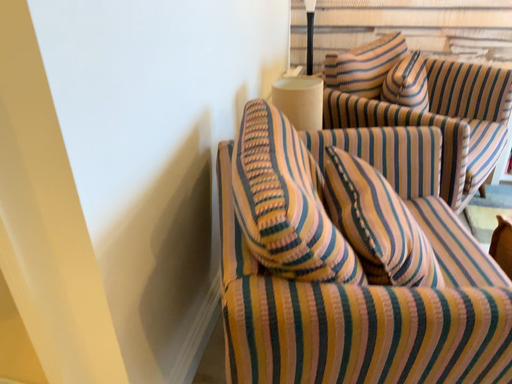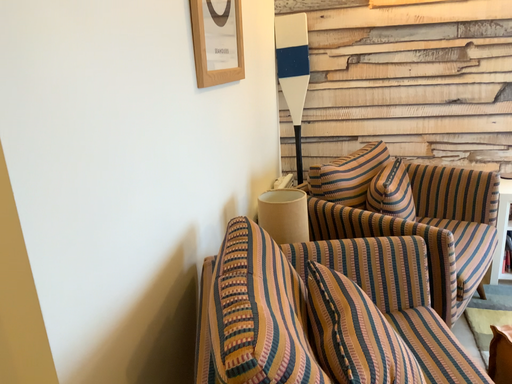
Question: Which way did the camera rotate in the video?

Choices:
 (A) rotated upward
 (B) rotated downward

Answer: (A)